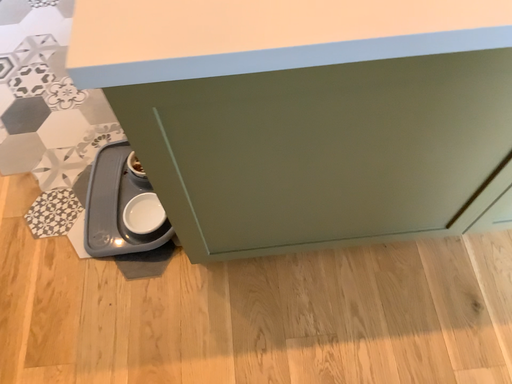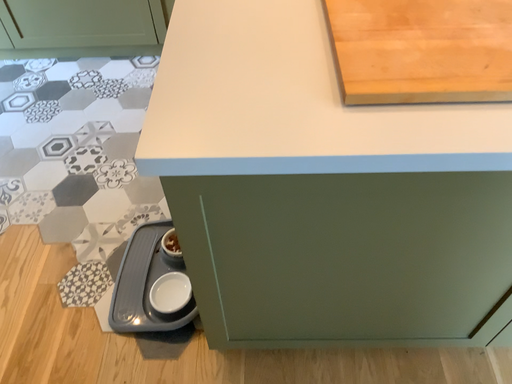
Question: Which way did the camera rotate in the video?

Choices:
 (A) rotated downward
 (B) rotated upward

Answer: (B)